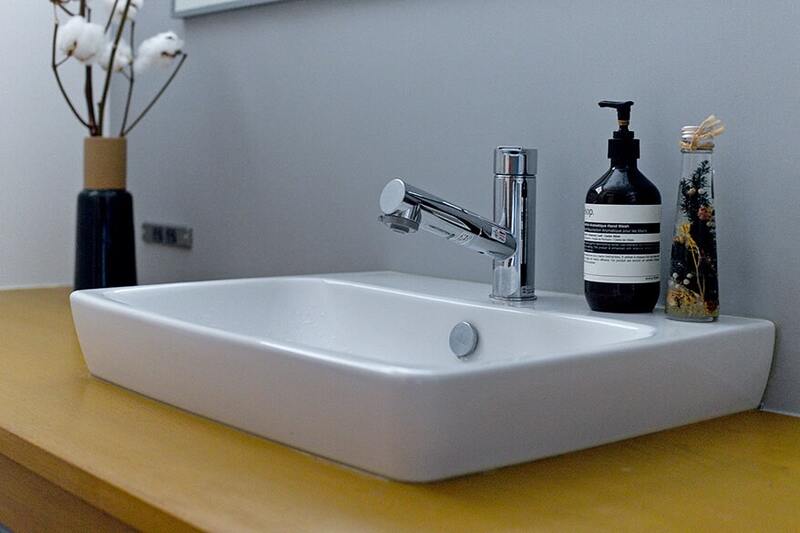
Where is `sink`? sink is located at coordinates (390, 310).